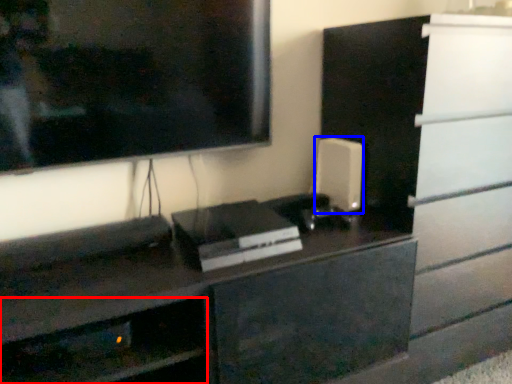
Question: Which point is closer to the camera, shelf (highlighted by a red box) or appliance (highlighted by a blue box)?

Choices:
 (A) shelf
 (B) appliance

Answer: (A)